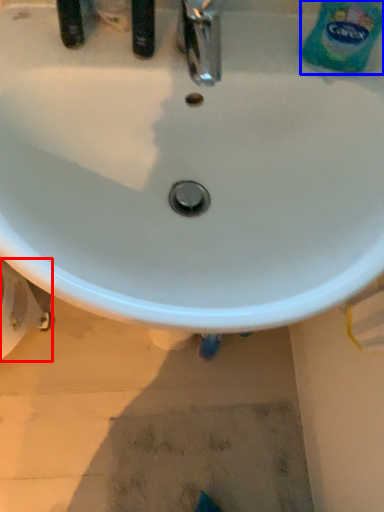
Question: Which point is further to the camera, bidet (highlighted by a red box) or cleaning product (highlighted by a blue box)?

Choices:
 (A) bidet
 (B) cleaning product

Answer: (A)